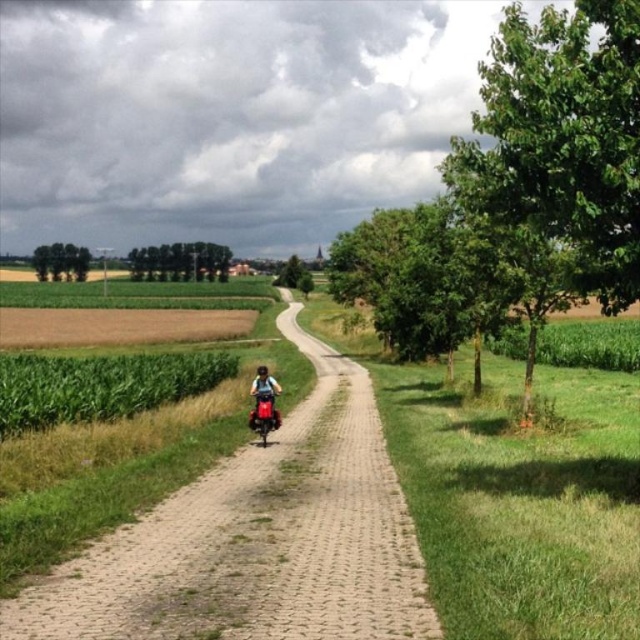
You are standing at the point marked as point (259, 538) in the image. What is the closest object to you?

The closest object to you is the paved brick path at center because the point (259, 538) corresponds to it.

You are standing at the starting point of the paved brick path at center and want to reach the distant trees. The green matte corn field at left is blocking your view. Which direction should you move to get a clear view of the distant trees?

Since the paved brick path at center is located below the green matte corn field at left, you should move to the right side of the path to avoid the obstruction from the corn field and get a clear view of the distant trees.

You are standing at the start of the paved brick path at center and want to place your dark blue fabric backpack at center on the ground. Can you put it directly on the path?

The paved brick path at center is positioned under dark blue fabric backpack at center, meaning the backpack is already placed on the path. So you can put it there directly.